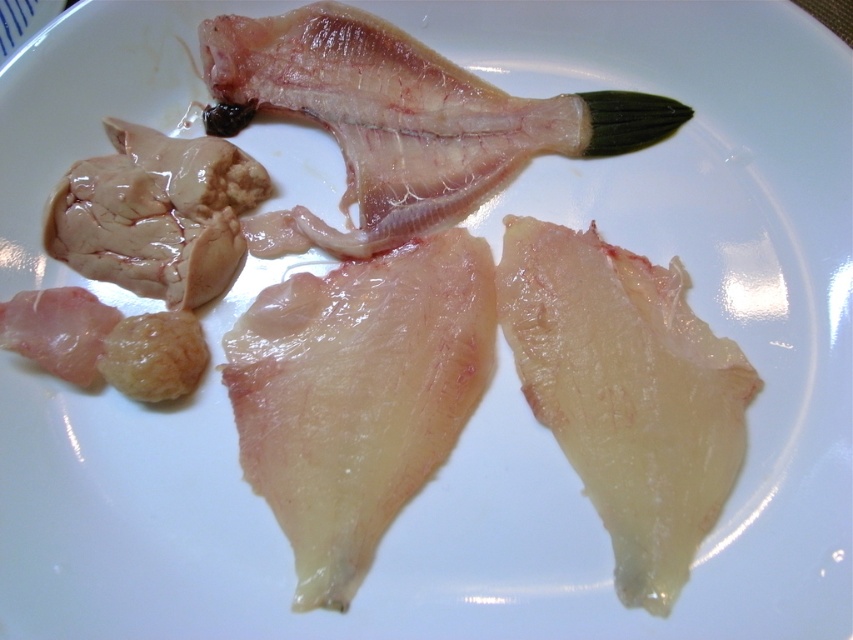
You are a chef preparing a sushi platter and need to arrange the translucent flesh at center and the translucent flesh fish at upper center on the plate. According to the image, where should you place each piece relative to the other?

The translucent flesh at center should be placed to the left of the translucent flesh fish at upper center as per the image.

What is located at the point with coordinates (358, 396) in the image?

The point at coordinates (358, 396) corresponds to the translucent flesh at center.